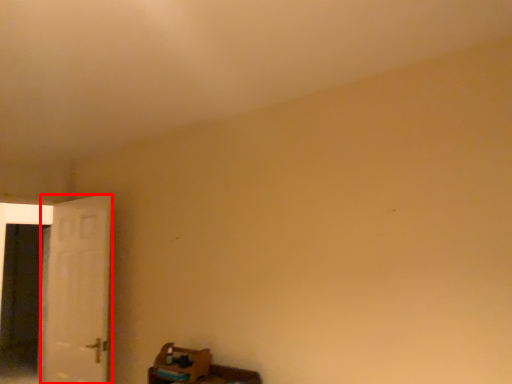
Question: From the image's perspective, where is door (annotated by the red box) located in relation to screen door in the image?

Choices:
 (A) below
 (B) above

Answer: (B)